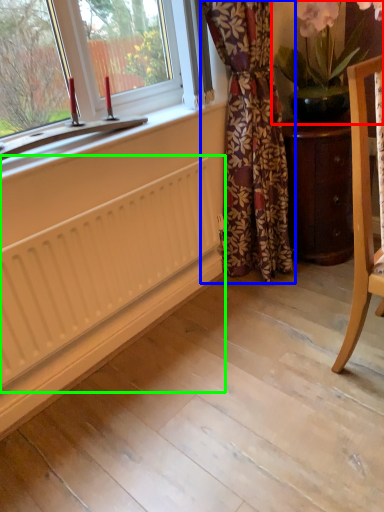
Question: Which object is the closest to the houseplant (highlighted by a red box)? Choose among these: curtain (highlighted by a blue box) or radiator (highlighted by a green box).

Choices:
 (A) curtain
 (B) radiator

Answer: (A)